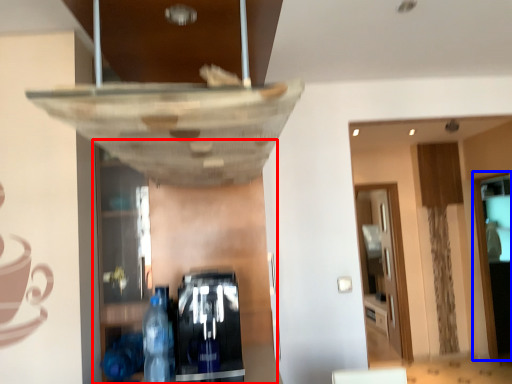
Question: Among these objects, which one is nearest to the camera, shelf (highlighted by a red box) or glass door (highlighted by a blue box)?

Choices:
 (A) shelf
 (B) glass door

Answer: (A)